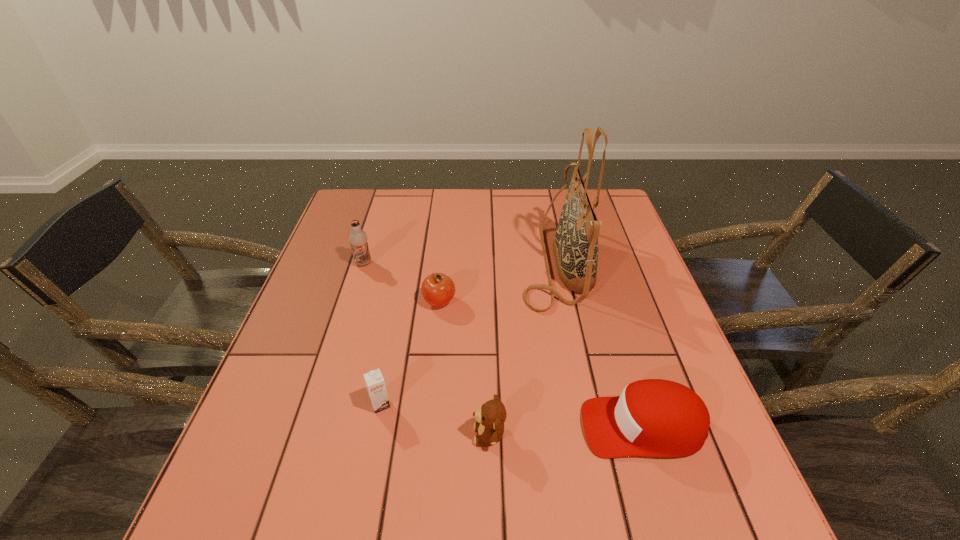
Where is `the second closest object relative to the left chocolate milk`? The width and height of the screenshot is (960, 540). the second closest object relative to the left chocolate milk is located at coordinates (375, 383).

The height and width of the screenshot is (540, 960). Find the location of `object that is the second closest one to the teddy bear`. object that is the second closest one to the teddy bear is located at coordinates (375, 383).

The image size is (960, 540). I want to click on vacant space that satisfies the following two spatial constraints: 1. on the front-facing side of the tallest object; 2. on the front side of the right chocolate milk, so click(585, 404).

Locate an element on the screen. The height and width of the screenshot is (540, 960). vacant area in the image that satisfies the following two spatial constraints: 1. on the front side of the right chocolate milk; 2. on the left side of the farther chocolate milk is located at coordinates (319, 404).